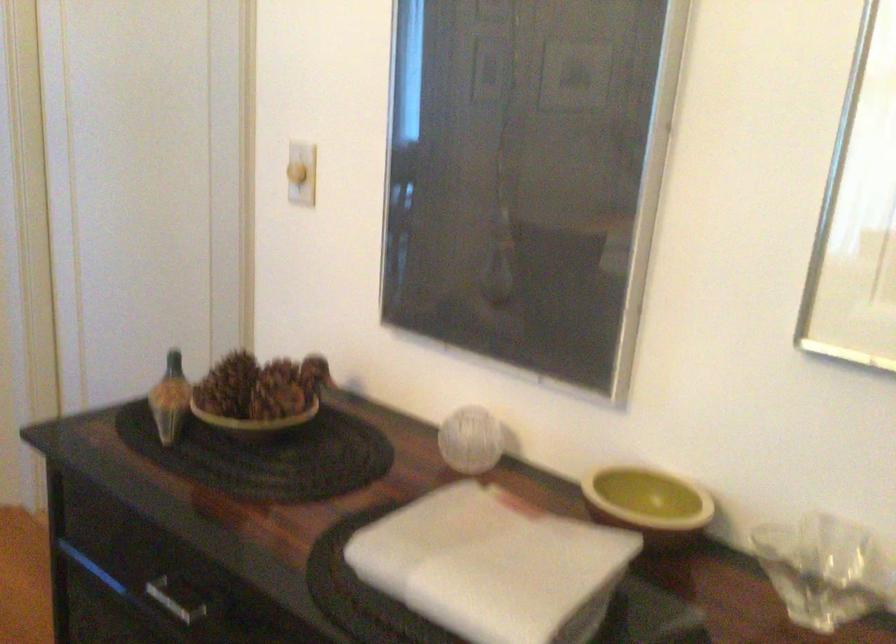
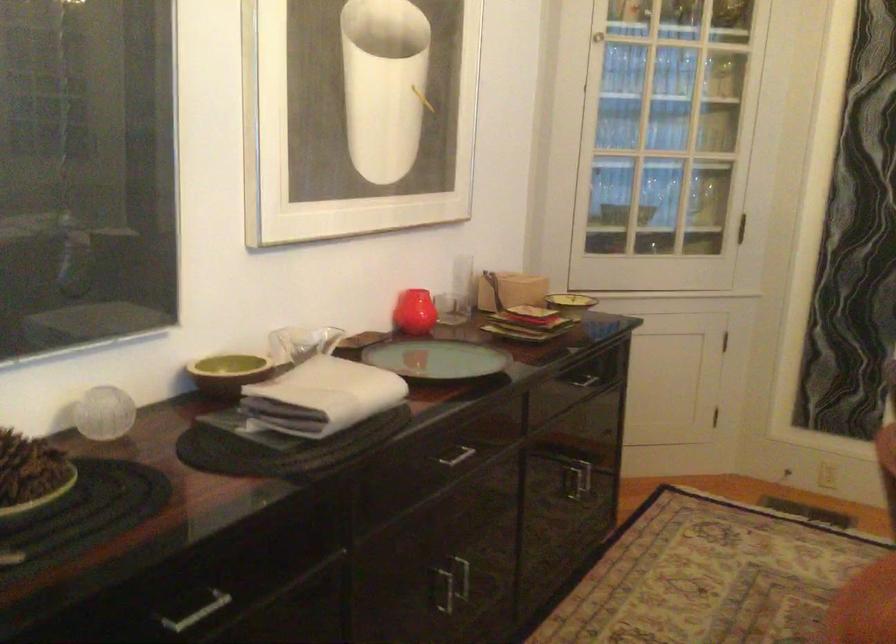
In the second image, find the point that corresponds to point 596,451 in the first image.

(228, 373)